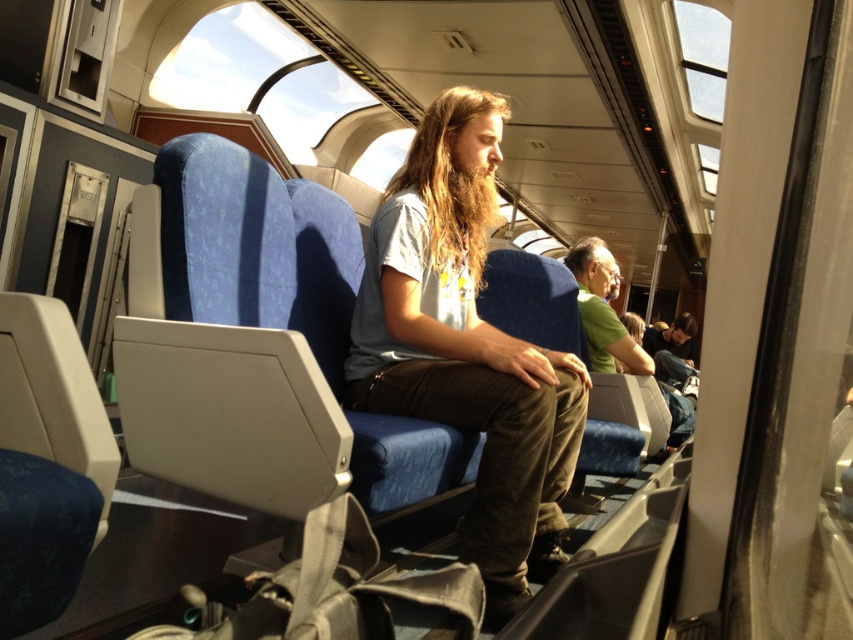
You are a passenger sitting in the train carriage and want to take a photo of the two points marked in the scene. Which point, point (x=350, y=344) or point (x=583, y=275), is closer to you?

Point (x=350, y=344) is closer to the camera than point (x=583, y=275), so it is closer to you.

You are a passenger sitting in the train carriage and notice two shirts at the center of your view. Which shirt is closer to you, the matte gray shirt at center or the green matte shirt at center?

The matte gray shirt at center is taller than the green matte shirt at center, so the green matte shirt at center is closer to you.

You are a tailor who needs to determine which shirt, the matte gray shirt at center or the green matte shirt at center, requires more fabric for alterations. Based on the image, which shirt would you prioritize for more fabric?

The matte gray shirt at center has a greater width than the green matte shirt at center, so it would require more fabric for alterations.